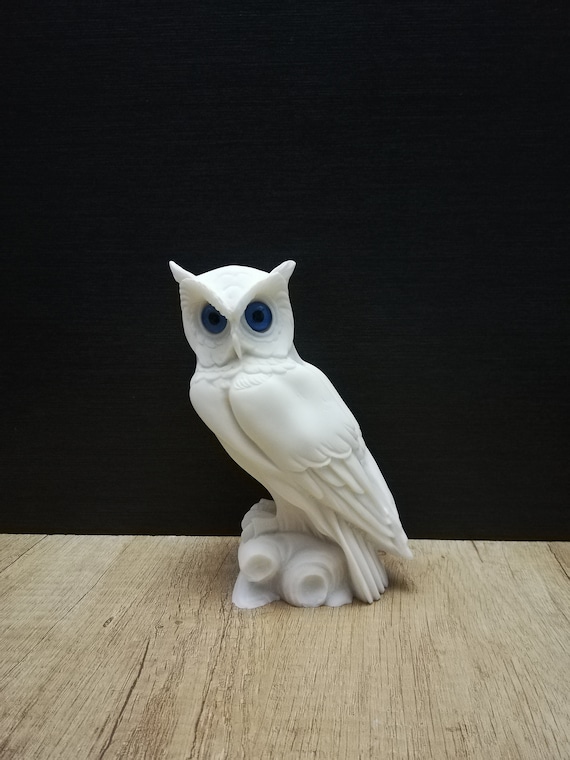
I want to click on owl sculpture, so click(285, 431).